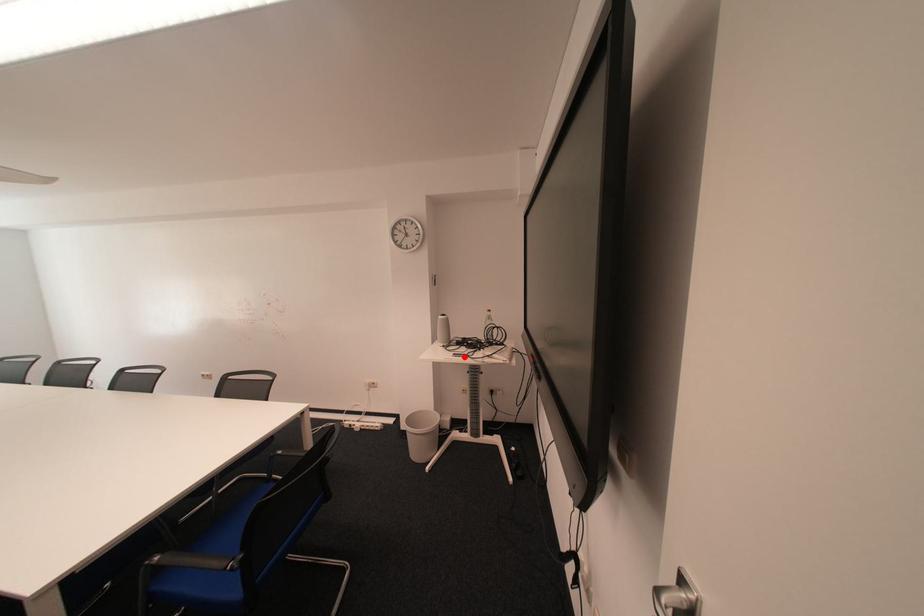
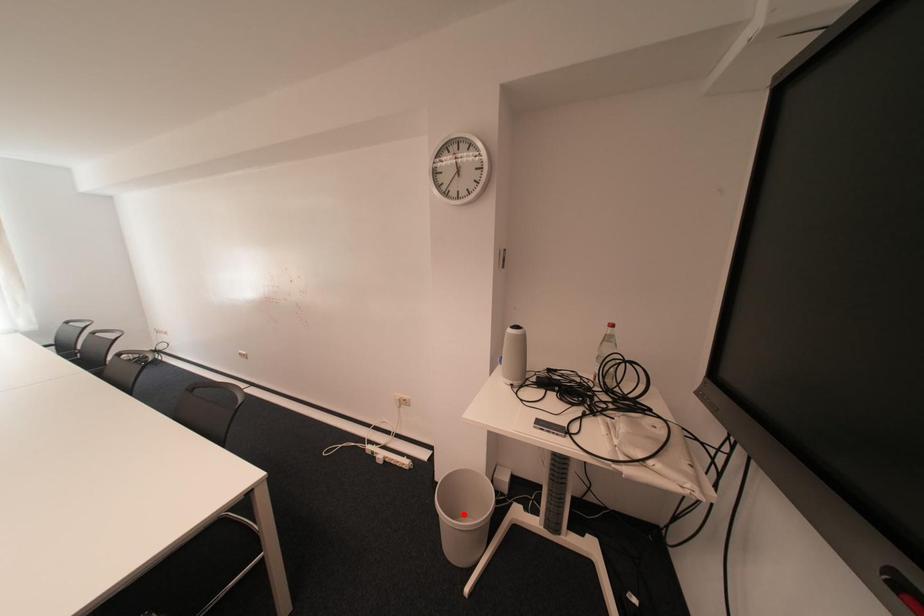
I am providing you with two images of the same scene from different viewpoints. A red point is marked on the first image and another point is marked on the second image. Does the point marked in image1 correspond to the same location as the one in image2?

No